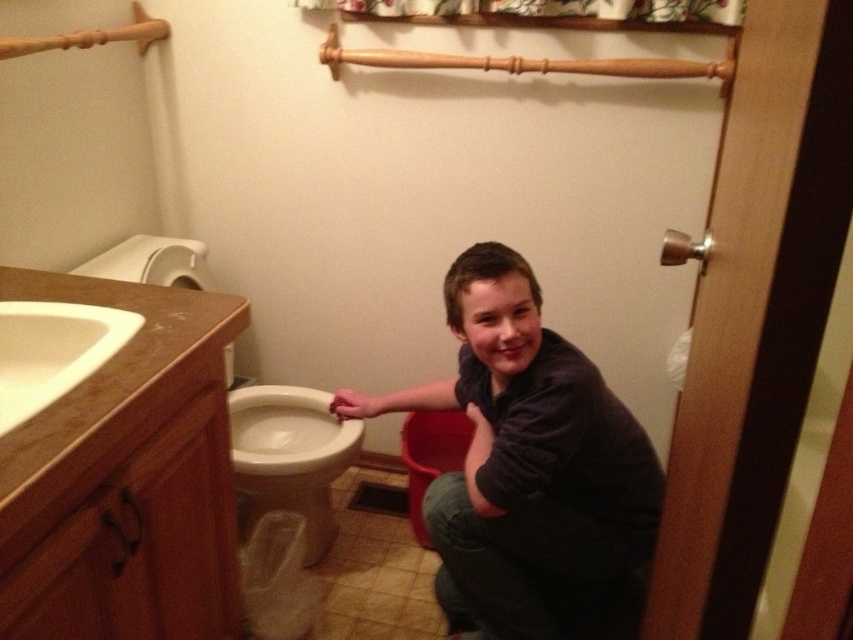
Question: Does white glossy toilet bowl at lower left have a smaller size compared to white glossy sink at upper left?

Choices:
 (A) yes
 (B) no

Answer: (B)

Question: Among these objects, which one is farthest from the camera?

Choices:
 (A) white glossy toilet bowl at lower left
 (B) white glossy sink at upper left
 (C) white glossy toilet at left
 (D) dark blue fabric at center

Answer: (C)

Question: Which point is closer to the camera?

Choices:
 (A) (343, 458)
 (B) (640, 560)
 (C) (277, 502)
 (D) (67, 307)

Answer: (D)

Question: Is white glossy toilet bowl at lower left above white glossy sink at upper left?

Choices:
 (A) yes
 (B) no

Answer: (B)

Question: Does dark blue fabric at center appear on the left side of white glossy toilet bowl at lower left?

Choices:
 (A) yes
 (B) no

Answer: (B)

Question: Which is farther from the white glossy toilet at left?

Choices:
 (A) dark blue fabric at center
 (B) white glossy sink at upper left

Answer: (B)